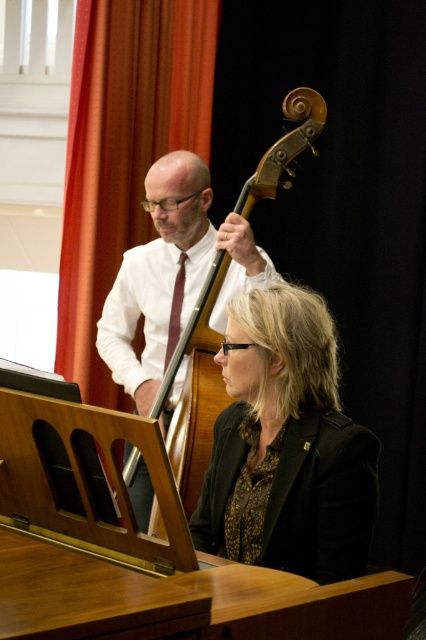
You are a photographer setting up for a photoshoot in this musical performance scene. You need to position a spotlight on the black textured blazer at center and the maroon satin tie at center. According to their positions, which one should you illuminate first to follow the natural viewing order from top to bottom?

The maroon satin tie at center should be illuminated first because it is positioned above the black textured blazer at center, following the natural top to bottom viewing order.

You are a photographer setting up for a photoshoot in this musical performance scene. You need to position a spotlight on the black textured blazer at center and the maroon satin tie at center. According to their positions, which one should you light first if you want to follow the natural left to right flow of the scene?

The maroon satin tie at center should be lit first because it is positioned to the left of the black textured blazer at center, following the natural left to right flow.